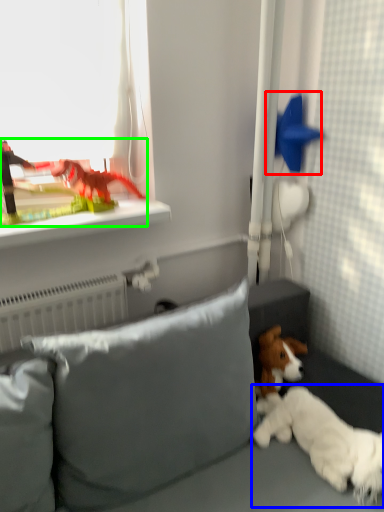
Question: Based on their relative distances, which object is nearer to toy (highlighted by a red box)? Choose from dog (highlighted by a blue box) and toy (highlighted by a green box).

Choices:
 (A) dog
 (B) toy

Answer: (B)